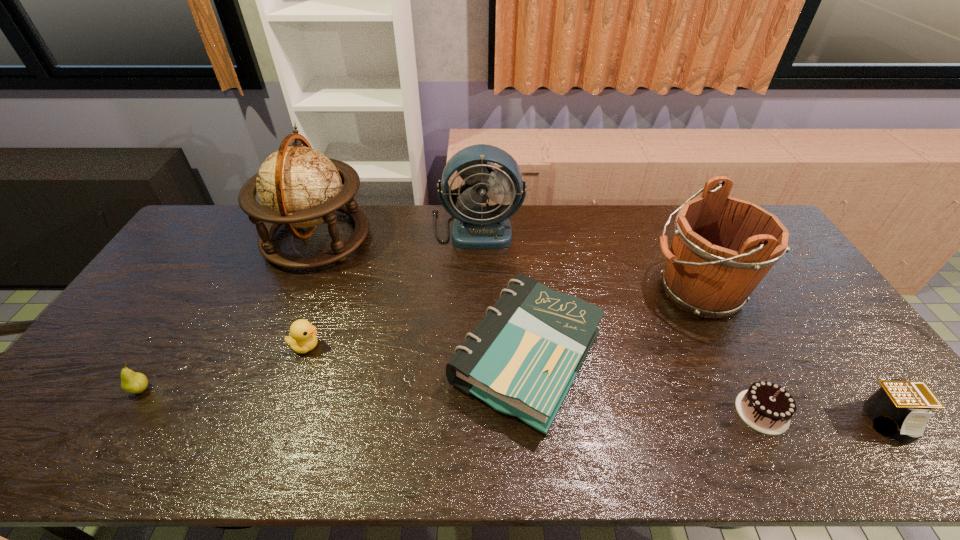
Image resolution: width=960 pixels, height=540 pixels. I want to click on paperback book at the near edge, so click(x=522, y=358).

At what (x,y) coordinates should I click in order to perform the action: click on chocolate cake at the near edge. Please return your answer as a coordinate pair (x, y). The height and width of the screenshot is (540, 960). Looking at the image, I should click on 766,407.

Identify the location of calculator at the near edge. (899, 408).

The height and width of the screenshot is (540, 960). What are the coordinates of `object located in the left edge section of the desktop` in the screenshot? It's located at (132, 382).

Locate an element on the screen. Image resolution: width=960 pixels, height=540 pixels. object that is positioned at the right edge is located at coordinates (899, 408).

Image resolution: width=960 pixels, height=540 pixels. Identify the location of object located in the near right corner section of the desktop. (899, 408).

In the image, there is a desktop. Identify the location of free space at the far edge. pos(569,245).

Find the location of `free region at the near edge of the desktop`. free region at the near edge of the desktop is located at coordinates (492, 455).

The width and height of the screenshot is (960, 540). What are the coordinates of `unoccupied position between the bucket and the rightmost object` in the screenshot? It's located at (793, 356).

This screenshot has height=540, width=960. Find the location of `vacant space that's between the leftmost object and the bucket`. vacant space that's between the leftmost object and the bucket is located at coordinates (419, 340).